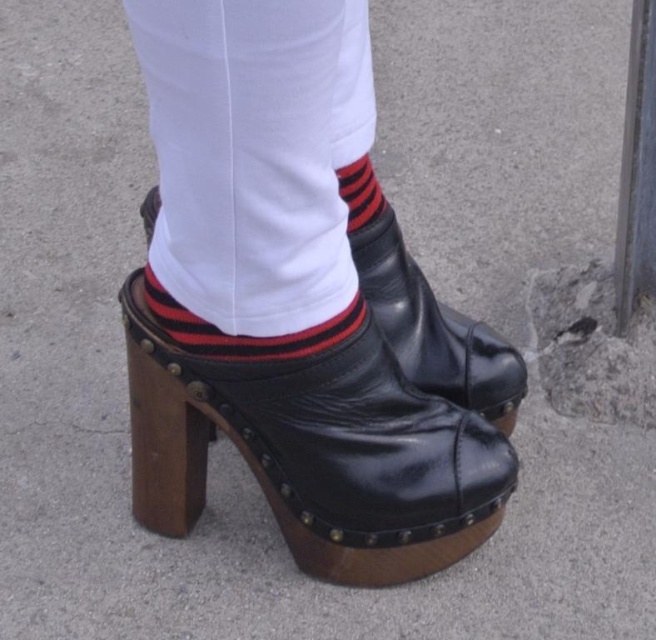
Consider the image. Is black leather socks at lower center further to the viewer compared to black striped sock at center?

No, black leather socks at lower center is closer to the viewer.

Between black leather socks at lower center and black striped sock at center, which one is positioned higher?

black leather socks at lower center

Is point (371, 86) positioned before point (371, 173)?

Yes, it is in front of point (371, 173).

Find the location of a particular element. black leather socks at lower center is located at coordinates (255, 154).

Is black leather clog at center shorter than shiny black boot at center?

Incorrect, black leather clog at center's height does not fall short of shiny black boot at center's.

Which is in front, point (354, 424) or point (394, 344)?

Point (354, 424)

Where is `black leather clog at center`? Image resolution: width=656 pixels, height=640 pixels. black leather clog at center is located at coordinates (316, 451).

Measure the distance between black leather socks at lower center and striped cotton sock at center.

black leather socks at lower center and striped cotton sock at center are 6.25 inches apart.

Does black leather socks at lower center have a smaller size compared to striped cotton sock at center?

No.

Between point (155, 248) and point (176, 307), which one is positioned behind?

The point (155, 248) is more distant.

Image resolution: width=656 pixels, height=640 pixels. I want to click on black leather socks at lower center, so click(x=255, y=154).